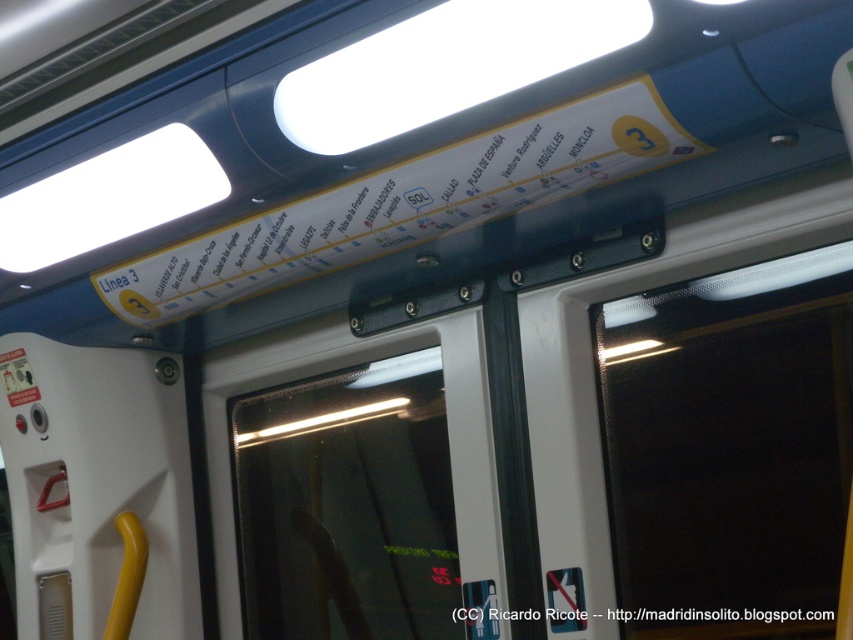
Question: Is transparent glass door at center positioned at the back of white paper sign at upper center?

Choices:
 (A) yes
 (B) no

Answer: (A)

Question: Observing the image, what is the correct spatial positioning of transparent glass door at center in reference to white paper sign at upper center?

Choices:
 (A) left
 (B) right

Answer: (A)

Question: Does transparent glass door at center have a larger size compared to white paper sign at upper center?

Choices:
 (A) yes
 (B) no

Answer: (A)